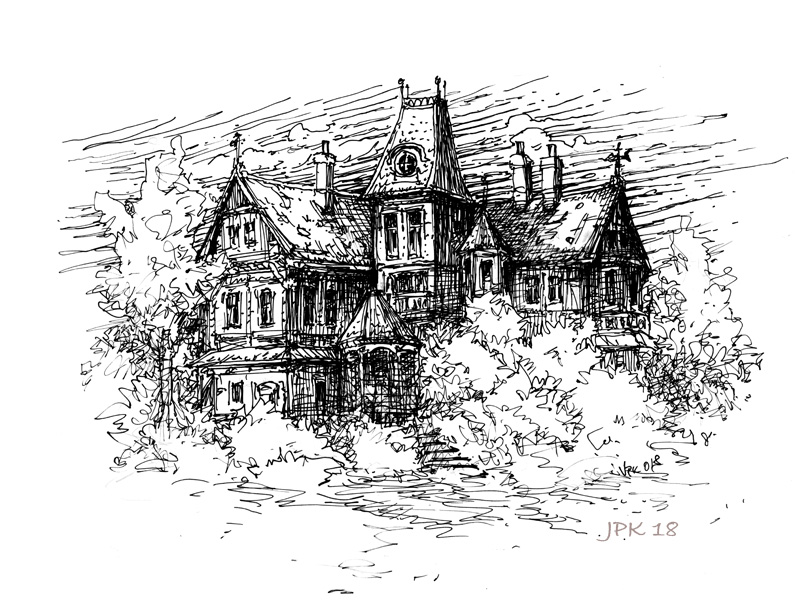
Identify the location of stairs. (454, 466), (457, 453), (442, 449), (429, 429).